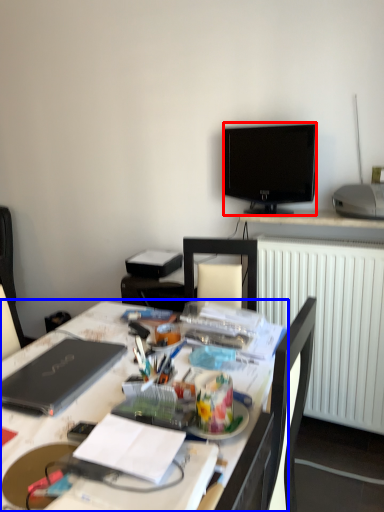
Question: Which of the following is the farthest to the observer, television (highlighted by a red box) or desk (highlighted by a blue box)?

Choices:
 (A) television
 (B) desk

Answer: (A)